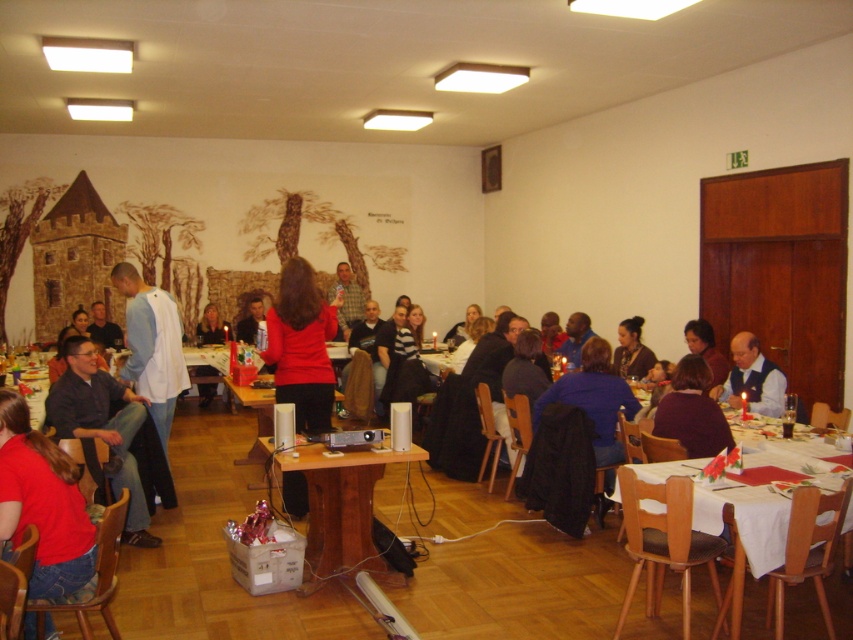
Consider the image. Between matte blue vest at lower right and wooden table at lower left, which one appears on the right side from the viewer's perspective?

matte blue vest at lower right

Who is more distant from viewer, (767, 380) or (26, 387)?

The point (26, 387) is behind.

Locate an element on the screen. The width and height of the screenshot is (853, 640). matte blue vest at lower right is located at coordinates (753, 378).

Between point (764, 500) and point (97, 413), which one is positioned in front?

Positioned in front is point (764, 500).

Identify the location of white cloth table at lower right. (746, 531).

Who is higher up, wooden table at lower left or light blue shirt at center?

light blue shirt at center is higher up.

Does wooden table at lower left appear over light blue shirt at center?

Incorrect, wooden table at lower left is not positioned above light blue shirt at center.

Is point (20, 358) behind point (91, 312)?

No, (20, 358) is in front of (91, 312).

Locate an element on the screen. The height and width of the screenshot is (640, 853). wooden table at lower left is located at coordinates (28, 381).